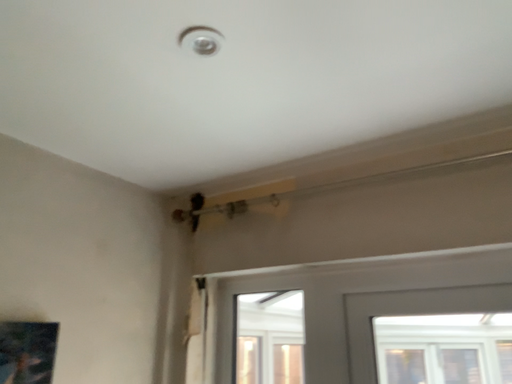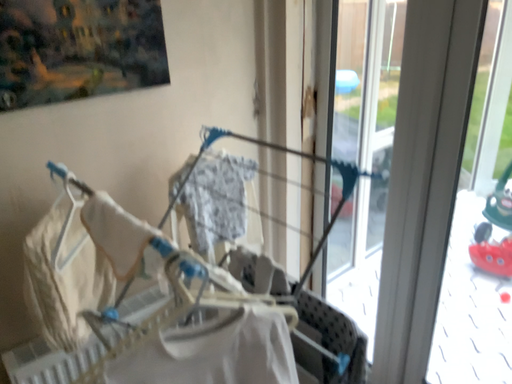
Question: How did the camera likely rotate when shooting the video?

Choices:
 (A) rotated left
 (B) rotated right

Answer: (A)